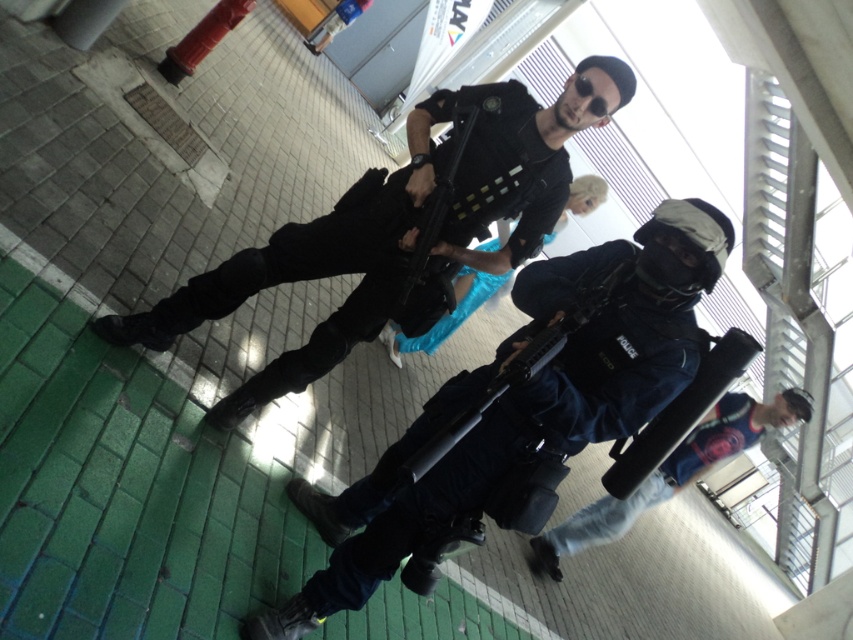
Question: Is matte black uniform at center behind blue fabric bag at lower right?

Choices:
 (A) no
 (B) yes

Answer: (A)

Question: Is dark blue uniform at center to the right of matte black uniform at center from the viewer's perspective?

Choices:
 (A) no
 (B) yes

Answer: (B)

Question: Can you confirm if dark blue uniform at center is smaller than blue fabric bag at lower right?

Choices:
 (A) yes
 (B) no

Answer: (B)

Question: Among these points, which one is nearest to the camera?

Choices:
 (A) (770, 412)
 (B) (405, 316)

Answer: (B)

Question: Which of the following is the closest to the observer?

Choices:
 (A) matte black uniform at center
 (B) blue fabric bag at lower right

Answer: (A)

Question: Which point appears closest to the camera in this image?

Choices:
 (A) click(785, 404)
 (B) click(380, 186)

Answer: (B)